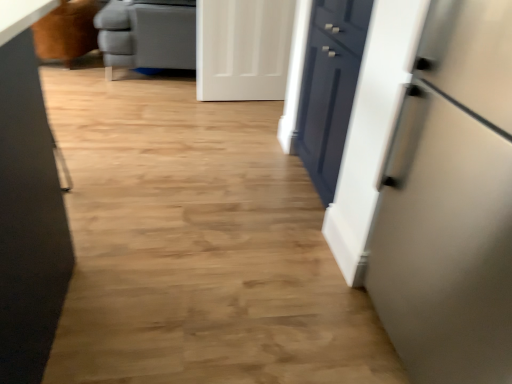
Locate an element on the screen. glossy dark blue drawer at center right is located at coordinates (329, 88).

Describe the element at coordinates (329, 88) in the screenshot. The height and width of the screenshot is (384, 512). I see `glossy dark blue drawer at center right` at that location.

The height and width of the screenshot is (384, 512). What do you see at coordinates (67, 31) in the screenshot?
I see `brown leather armchair at upper left` at bounding box center [67, 31].

In order to face white matte door at upper center, should I rotate leftwards or rightwards?

You should look left and rotate roughly 1.144 degrees.

Locate an element on the screen. The height and width of the screenshot is (384, 512). glossy dark blue drawer at center right is located at coordinates (329, 88).

From the image's perspective, which one is positioned higher, gray leather ottoman at upper left or brown leather armchair at upper left?

gray leather ottoman at upper left, from the image's perspective.

Is brown leather armchair at upper left at the back of gray leather ottoman at upper left?

No, brown leather armchair at upper left is not at the back of gray leather ottoman at upper left.

Is gray leather ottoman at upper left outside of brown leather armchair at upper left?

Indeed, gray leather ottoman at upper left is completely outside brown leather armchair at upper left.

Which is nearer, (187, 16) or (87, 37)?

Point (187, 16) is closer to the camera than point (87, 37).

Is brown leather armchair at upper left facing towards gray leather ottoman at upper left?

No.

Considering the relative sizes of brown leather armchair at upper left and gray leather ottoman at upper left in the image provided, is brown leather armchair at upper left shorter than gray leather ottoman at upper left?

Yes, brown leather armchair at upper left is shorter than gray leather ottoman at upper left.

Considering the positions of point (82, 37) and point (192, 23), is point (82, 37) closer or farther from the camera than point (192, 23)?

Clearly, point (82, 37) is more distant from the camera than point (192, 23).

How many degrees apart are the facing directions of brown leather armchair at upper left and white matte door at upper center?

They differ by 161 degrees in their facing directions.

Considering the sizes of brown leather armchair at upper left and white matte door at upper center in the image, is brown leather armchair at upper left wider or thinner than white matte door at upper center?

brown leather armchair at upper left is wider than white matte door at upper center.

From a real-world perspective, is brown leather armchair at upper left over white matte door at upper center?

Incorrect, from a real-world perspective, brown leather armchair at upper left is lower than white matte door at upper center.

Which object is more forward, glossy dark blue drawer at center right or brown leather armchair at upper left?

glossy dark blue drawer at center right is closer to the camera.

Is glossy dark blue drawer at center right facing away from brown leather armchair at upper left?

No, glossy dark blue drawer at center right's orientation is not away from brown leather armchair at upper left.

Based on the photo, considering the positions of objects glossy dark blue drawer at center right and brown leather armchair at upper left in the image provided, who is more to the right, glossy dark blue drawer at center right or brown leather armchair at upper left?

From the viewer's perspective, glossy dark blue drawer at center right appears more on the right side.

Based on their sizes in the image, would you say glossy dark blue drawer at center right is bigger or smaller than brown leather armchair at upper left?

Considering their sizes, glossy dark blue drawer at center right takes up less space than brown leather armchair at upper left.

Measure the distance between gray leather ottoman at upper left and glossy dark blue drawer at center right.

gray leather ottoman at upper left and glossy dark blue drawer at center right are 1.76 meters apart.

Which of these two, gray leather ottoman at upper left or glossy dark blue drawer at center right, is smaller?

glossy dark blue drawer at center right is smaller.

From the image's perspective, who appears lower, gray leather ottoman at upper left or glossy dark blue drawer at center right?

glossy dark blue drawer at center right is shown below in the image.

What's the angular difference between gray leather ottoman at upper left and glossy dark blue drawer at center right's facing directions?

They differ by 89.4 degrees in their facing directions.

Is satin white refrigerator at right closer to the viewer compared to white matte door at upper center?

Yes, satin white refrigerator at right is closer to the viewer.

Is satin white refrigerator at right outside of white matte door at upper center?

satin white refrigerator at right is positioned outside white matte door at upper center.

Is satin white refrigerator at right to the left or to the right of white matte door at upper center in the image?

From the image, it's evident that satin white refrigerator at right is to the right of white matte door at upper center.

In the scene shown: Choose the correct answer: Is glossy dark blue drawer at center right inside satin white refrigerator at right or outside it?

glossy dark blue drawer at center right is located beyond the bounds of satin white refrigerator at right.

Between glossy dark blue drawer at center right and satin white refrigerator at right, which one has larger width?

With larger width is satin white refrigerator at right.

From the image's perspective, does glossy dark blue drawer at center right appear higher than satin white refrigerator at right?

Yes.

I want to click on armchair lying behind the gray leather ottoman at upper left, so click(x=67, y=31).

At what (x,y) coordinates should I click in order to perform the action: click on furniture on the right of brown leather armchair at upper left. Please return your answer as a coordinate pair (x, y). Image resolution: width=512 pixels, height=384 pixels. Looking at the image, I should click on [147, 34].

Estimate the real-world distances between objects in this image. Which object is closer to white matte door at upper center, glossy dark blue drawer at center right or gray leather ottoman at upper left?

gray leather ottoman at upper left.

Looking at this image, which object lies nearer to the anchor point glossy dark blue drawer at center right, white matte door at upper center or gray leather ottoman at upper left?

white matte door at upper center is closer to glossy dark blue drawer at center right.

Based on their spatial positions, is white matte door at upper center or glossy dark blue drawer at center right further from brown leather armchair at upper left?

The object further to brown leather armchair at upper left is glossy dark blue drawer at center right.

Looking at the image, which one is located further to satin white refrigerator at right, white matte door at upper center or glossy dark blue drawer at center right?

Among the two, white matte door at upper center is located further to satin white refrigerator at right.

Considering their positions, is brown leather armchair at upper left positioned further to satin white refrigerator at right than glossy dark blue drawer at center right?

brown leather armchair at upper left lies further to satin white refrigerator at right than the other object.

Based on their spatial positions, is brown leather armchair at upper left or gray leather ottoman at upper left closer to glossy dark blue drawer at center right?

The object closer to glossy dark blue drawer at center right is gray leather ottoman at upper left.

From the image, which object appears to be farther from white matte door at upper center, satin white refrigerator at right or glossy dark blue drawer at center right?

Based on the image, satin white refrigerator at right appears to be further to white matte door at upper center.

From the image, which object appears to be nearer to white matte door at upper center, brown leather armchair at upper left or gray leather ottoman at upper left?

gray leather ottoman at upper left lies closer to white matte door at upper center than the other object.

Locate an element on the screen. This screenshot has height=384, width=512. door between satin white refrigerator at right and brown leather armchair at upper left along the z-axis is located at coordinates (243, 49).

At what (x,y) coordinates should I click in order to perform the action: click on drawer between satin white refrigerator at right and white matte door at upper center in the front-back direction. Please return your answer as a coordinate pair (x, y). The image size is (512, 384). Looking at the image, I should click on (329, 88).

Find the location of `drawer between satin white refrigerator at right and brown leather armchair at upper left along the z-axis`. drawer between satin white refrigerator at right and brown leather armchair at upper left along the z-axis is located at coordinates (329, 88).

I want to click on furniture between brown leather armchair at upper left and white matte door at upper center from left to right, so click(147, 34).